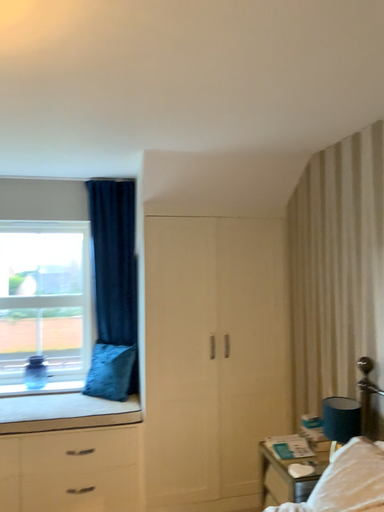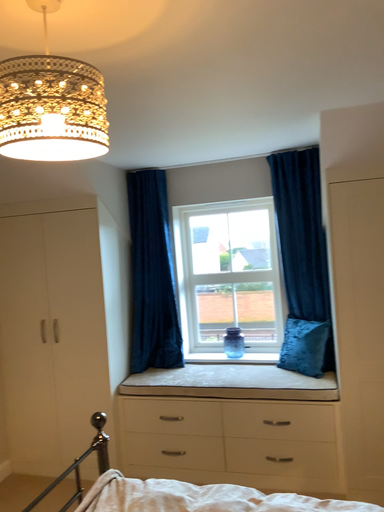
Question: How did the camera likely rotate when shooting the video?

Choices:
 (A) rotated left
 (B) rotated right

Answer: (A)